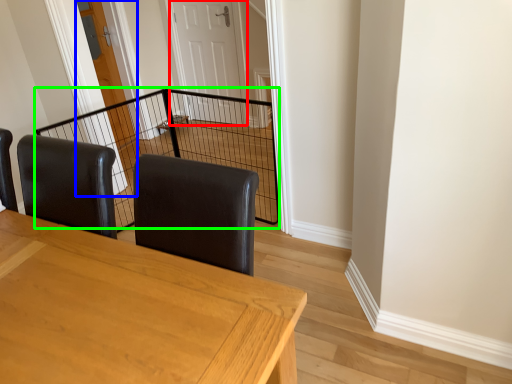
Question: Estimate the real-world distances between objects in this image. Which object is closer to door (highlighted by a red box), door (highlighted by a blue box) or cage (highlighted by a green box)?

Choices:
 (A) door
 (B) cage

Answer: (B)